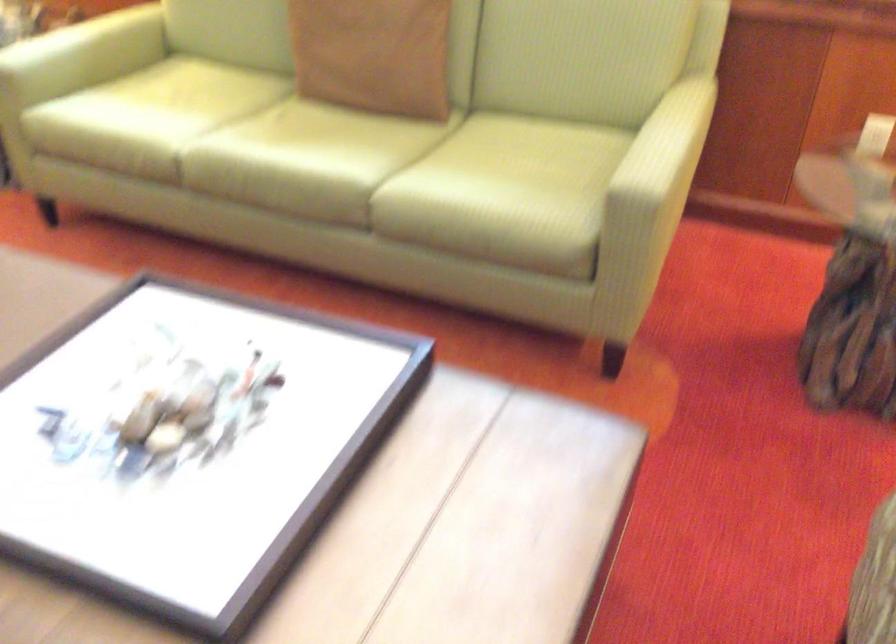
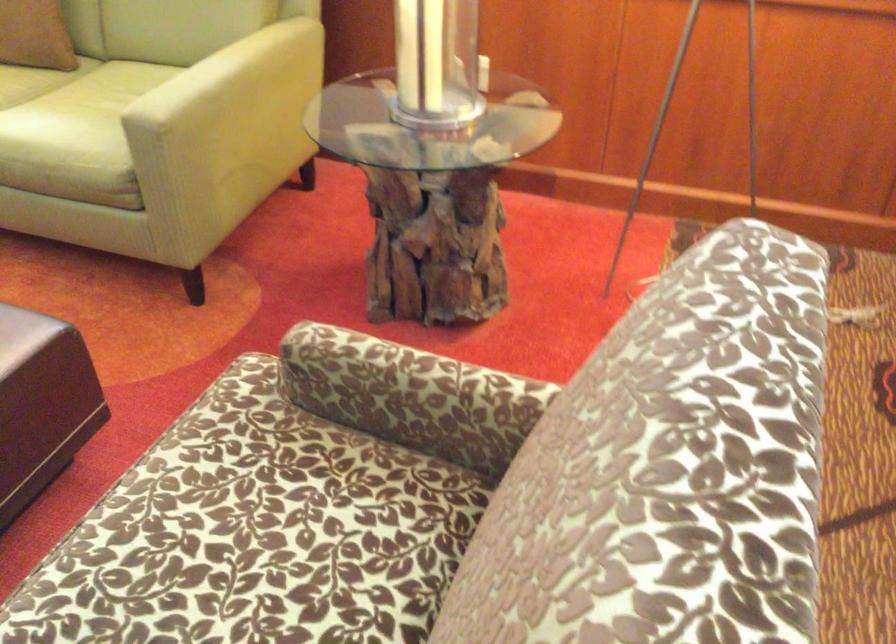
Question: The camera is either moving clockwise (left) or counter-clockwise (right) around the object. The first image is from the beginning of the video and the second image is from the end. Is the camera moving left or right when shooting the video?

Choices:
 (A) Left
 (B) Right

Answer: (A)